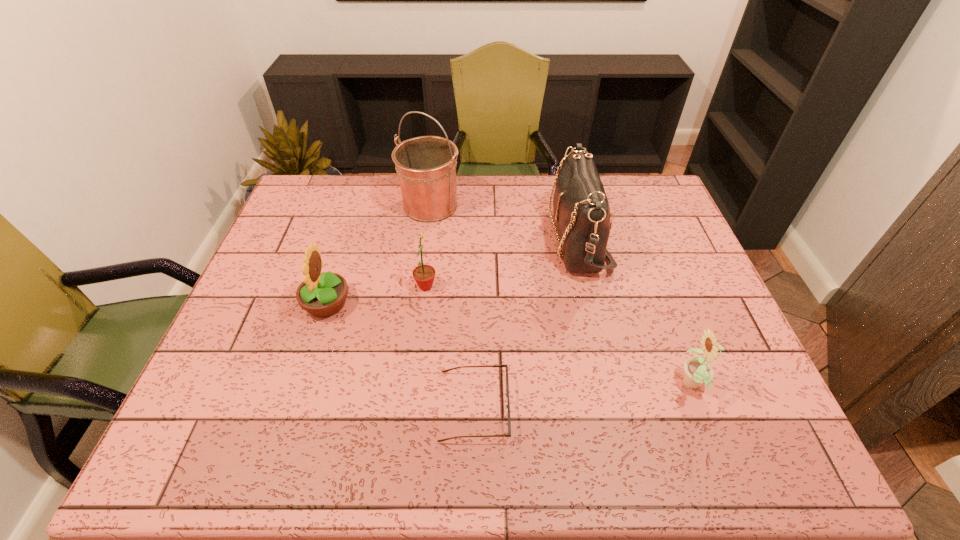
Locate an element on the screen. free area in between the shortest object and the second sunflower from left to right is located at coordinates (450, 346).

Image resolution: width=960 pixels, height=540 pixels. I want to click on empty space between the leftmost sunflower and the rightmost object, so click(x=510, y=345).

I want to click on empty space between the rightmost object and the shortest object, so coord(584,396).

Where is `vacant area that lies between the leftmost sunflower and the bucket`? vacant area that lies between the leftmost sunflower and the bucket is located at coordinates (378, 255).

Find the location of a particular element. The height and width of the screenshot is (540, 960). vacant space in between the shortest object and the fifth shortest object is located at coordinates (526, 322).

Identify the location of vacant space that's between the leftmost object and the spectacles. (400, 355).

Image resolution: width=960 pixels, height=540 pixels. What are the coordinates of `vacant space that is in between the shortest object and the tallest object` in the screenshot? It's located at (452, 306).

This screenshot has width=960, height=540. I want to click on free area in between the handbag and the shortest object, so click(x=526, y=322).

Locate which object is the fifth closest to the fifth shortest object. Please provide its 2D coordinates. Your answer should be formatted as a tuple, i.e. [(x, y)], where the tuple contains the x and y coordinates of a point satisfying the conditions above.

[(324, 294)]

Point out which object is positioned as the second nearest to the shortest object. Please provide its 2D coordinates. Your answer should be formatted as a tuple, i.e. [(x, y)], where the tuple contains the x and y coordinates of a point satisfying the conditions above.

[(324, 294)]